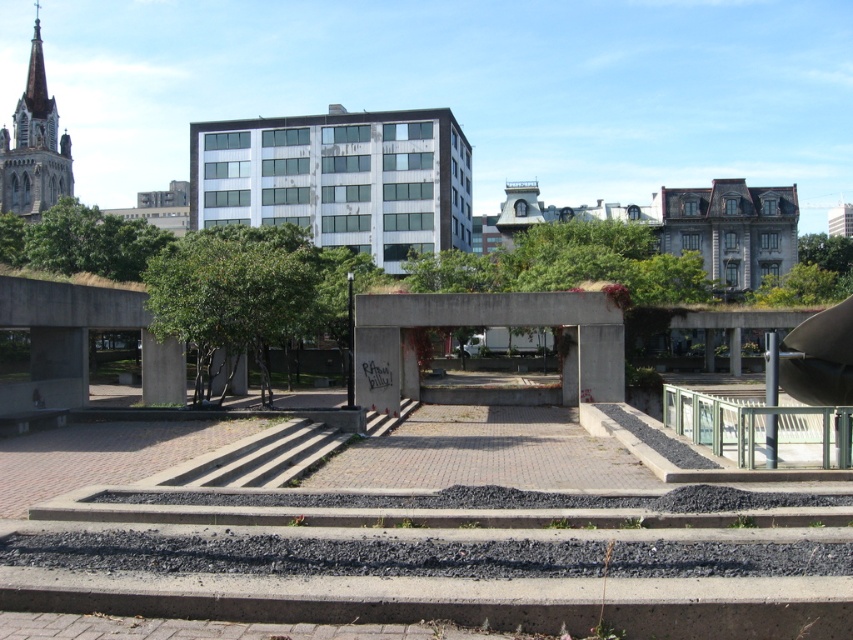
Question: Which object is the farthest from the green leafy tree at center?

Choices:
 (A) green leafy tree at upper right
 (B) green leafy tree at upper left

Answer: (A)

Question: Does green leafy tree at upper left appear on the right side of green leafy tree at upper right?

Choices:
 (A) no
 (B) yes

Answer: (A)

Question: Which point is closer to the camera taking this photo?

Choices:
 (A) (24, 260)
 (B) (225, 292)

Answer: (B)

Question: Which point is farther to the camera?

Choices:
 (A) green leafy tree at upper left
 (B) green leafy tree at center

Answer: (A)

Question: Considering the relative positions of green leafy tree at upper left and green leafy tree at upper right in the image provided, where is green leafy tree at upper left located with respect to green leafy tree at upper right?

Choices:
 (A) above
 (B) below

Answer: (B)

Question: In this image, where is green leafy tree at center located relative to green leafy tree at upper left?

Choices:
 (A) right
 (B) left

Answer: (A)